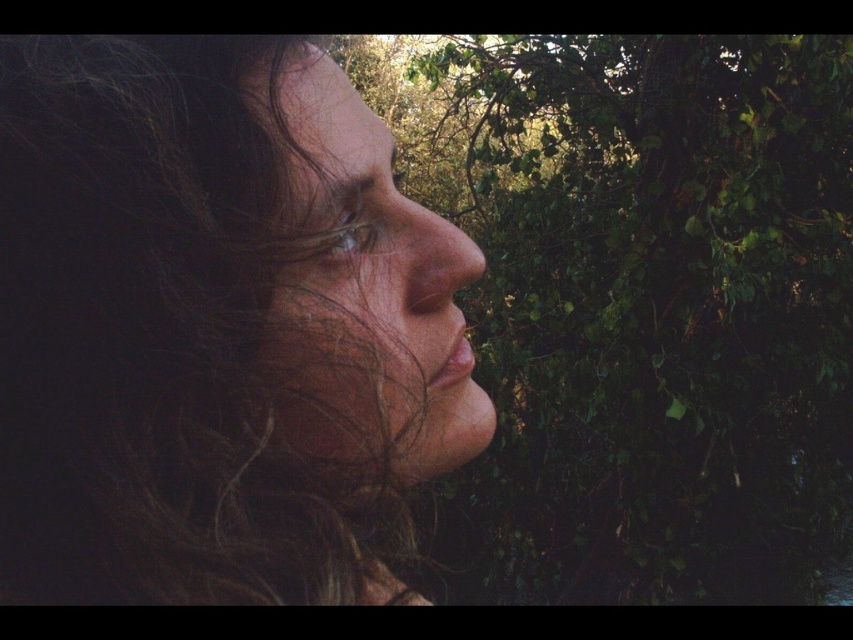
Does green leafy tree at right come behind smooth skin face at center?

Yes, green leafy tree at right is behind smooth skin face at center.

Between green leafy tree at right and smooth skin face at center, which one appears on the right side from the viewer's perspective?

Positioned to the right is green leafy tree at right.

Between point (697, 355) and point (328, 284), which one is positioned behind?

The point (697, 355) is behind.

This screenshot has height=640, width=853. What are the coordinates of `green leafy tree at right` in the screenshot? It's located at (654, 308).

Does dark curly hair at left come in front of smooth skin face at center?

Yes, dark curly hair at left is in front of smooth skin face at center.

Who is positioned more to the left, dark curly hair at left or smooth skin face at center?

dark curly hair at left is more to the left.

Locate an element on the screen. dark curly hair at left is located at coordinates (213, 324).

Between dark curly hair at left and green leafy tree at right, which one has less height?

With less height is dark curly hair at left.

Is point (30, 422) less distant than point (798, 348)?

That is True.

The height and width of the screenshot is (640, 853). Describe the element at coordinates (213, 324) in the screenshot. I see `dark curly hair at left` at that location.

Where is `dark curly hair at left`? dark curly hair at left is located at coordinates (213, 324).